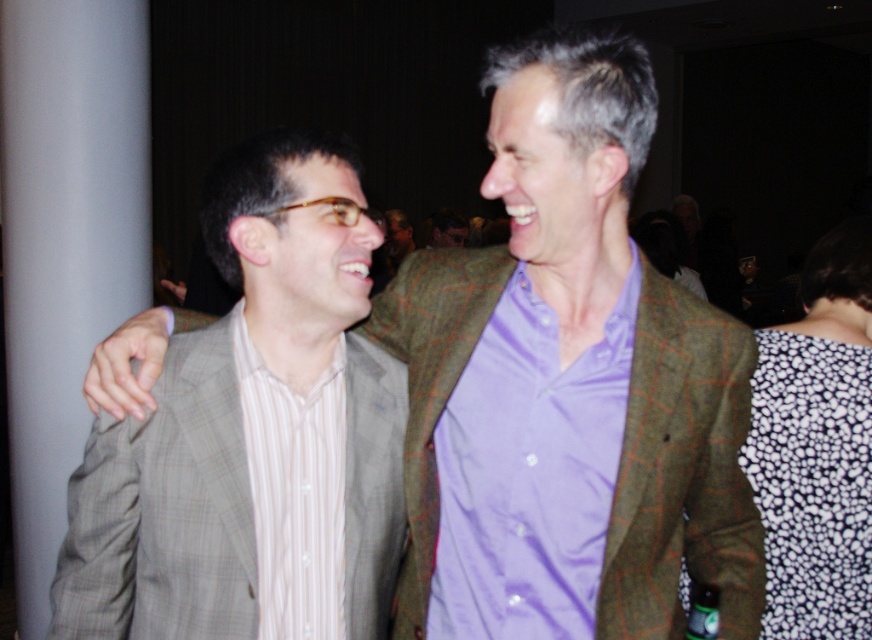
Question: In this image, where is light gray checkered suit at center located relative to white striped shirt at left?

Choices:
 (A) left
 (B) right

Answer: (A)

Question: Which is farther from the light gray checkered suit at center?

Choices:
 (A) lavender satin shirt at center
 (B) white striped shirt at left
 (C) matte gray suit at center

Answer: (A)

Question: Does matte gray suit at center appear on the right side of light gray checkered suit at center?

Choices:
 (A) no
 (B) yes

Answer: (B)

Question: Which point is farther from the camera taking this photo?

Choices:
 (A) (305, 561)
 (B) (209, 426)

Answer: (A)

Question: Is matte gray suit at center below light gray checkered suit at center?

Choices:
 (A) no
 (B) yes

Answer: (A)

Question: Among these objects, which one is nearest to the camera?

Choices:
 (A) light gray checkered suit at center
 (B) lavender satin shirt at center

Answer: (A)